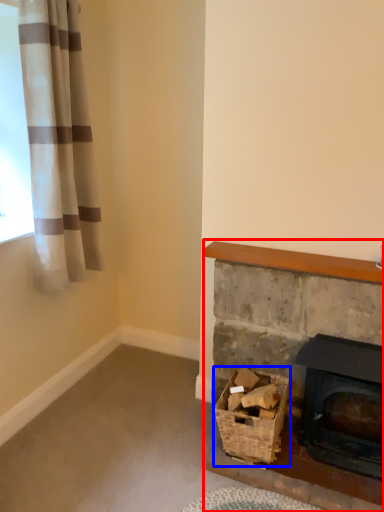
Question: Among these objects, which one is farthest to the camera, fireplace (highlighted by a red box) or basket (highlighted by a blue box)?

Choices:
 (A) fireplace
 (B) basket

Answer: (B)